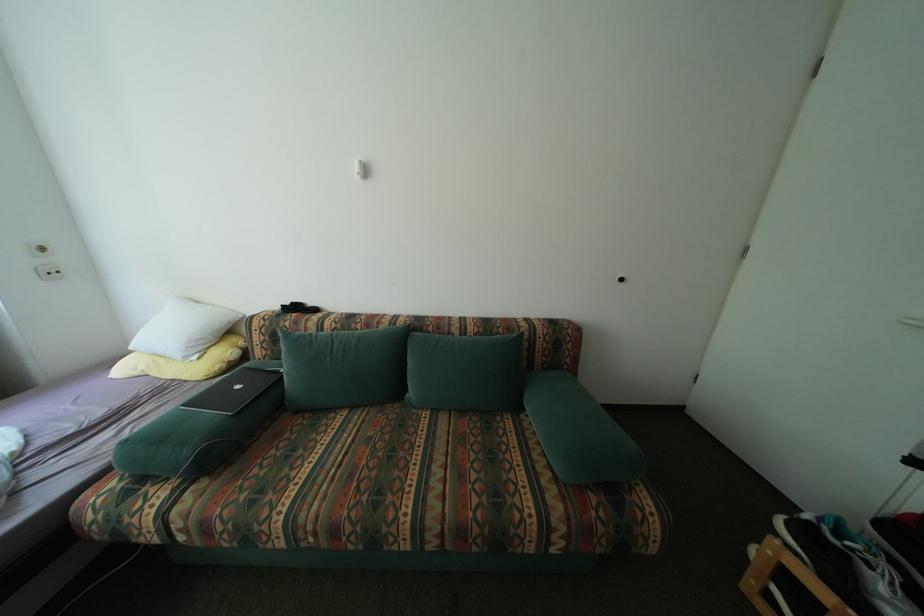
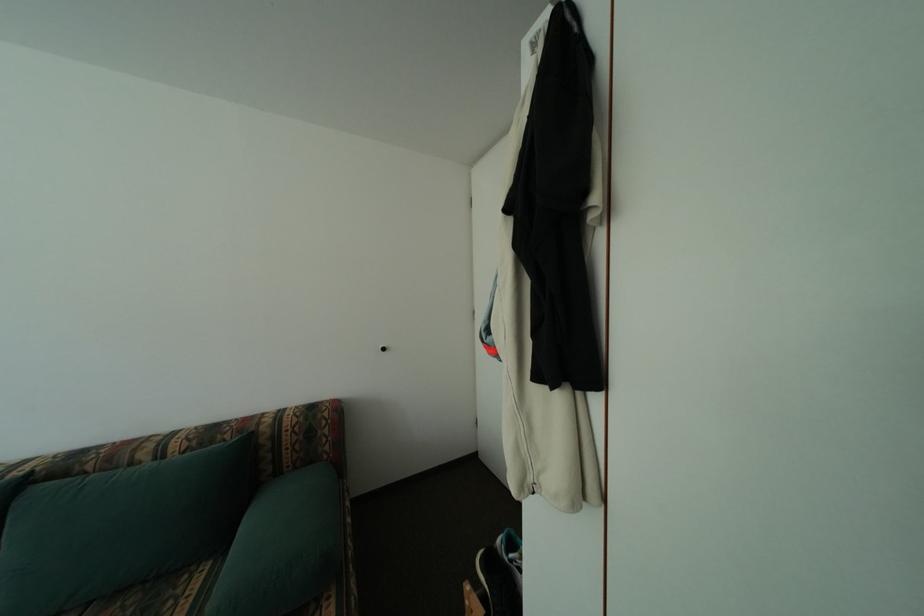
Question: How did the camera likely rotate?

Choices:
 (A) Left
 (B) Right
 (C) Up
 (D) Down

Answer: (B)